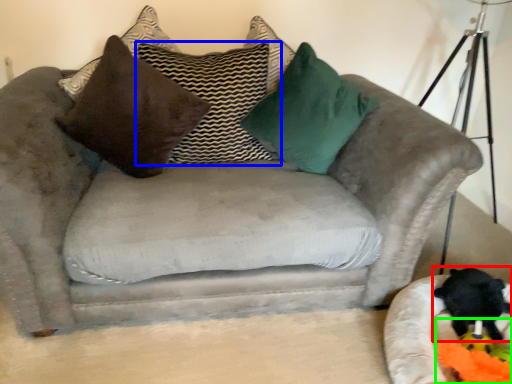
Question: Estimate the real-world distances between objects in this image. Which object is closer to animal (highlighted by a red box), pillow (highlighted by a blue box) or toy (highlighted by a green box)?

Choices:
 (A) pillow
 (B) toy

Answer: (B)